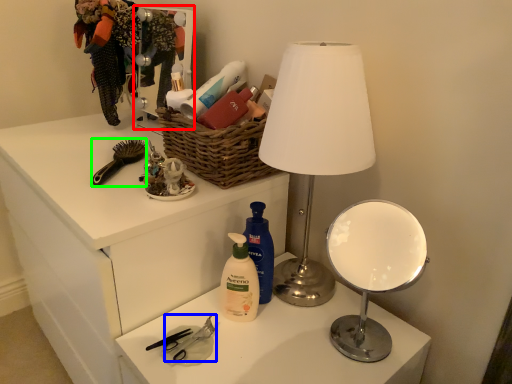
Question: Considering the real-world distances, which object is closest to mirror (highlighted by a red box)? scissors (highlighted by a blue box) or brush (highlighted by a green box).

Choices:
 (A) scissors
 (B) brush

Answer: (B)